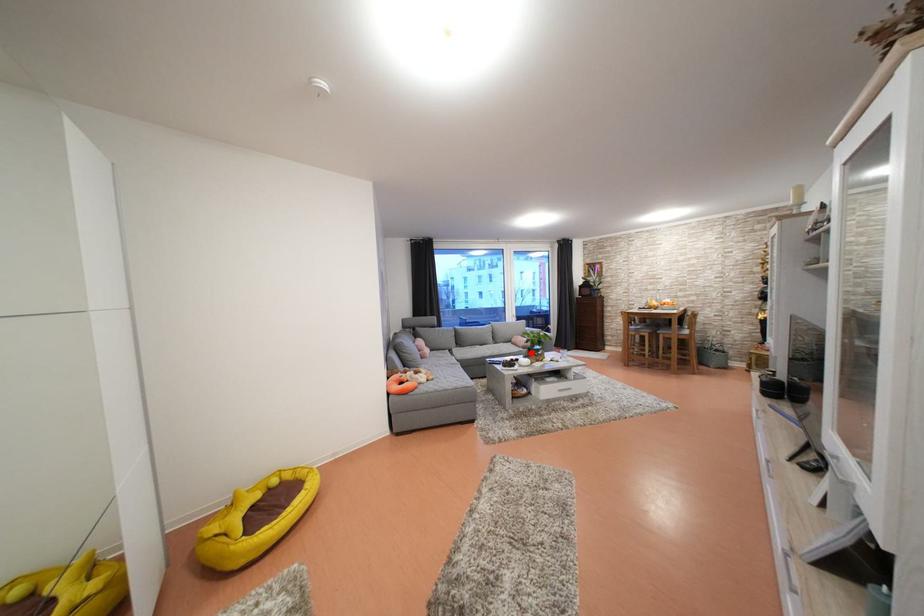
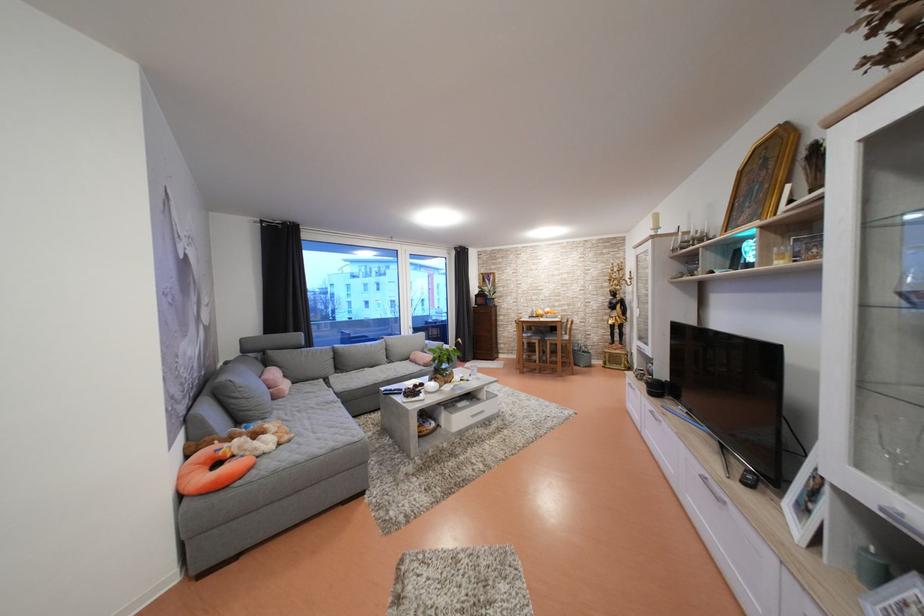
Locate, in the second image, the point that corresponds to the highlighted location in the first image.

(432, 370)